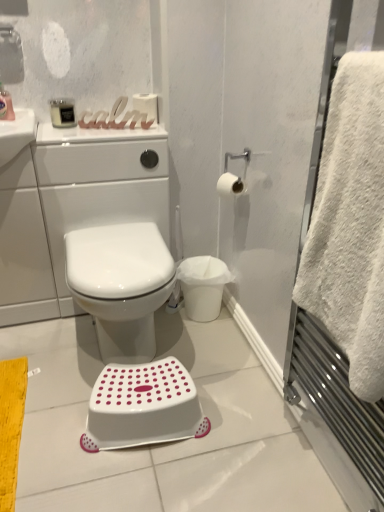
At what (x,y) coordinates should I click in order to perform the action: click on empty space that is ontop of white plastic step stool at center. Please return your answer as a coordinate pair (x, y). The width and height of the screenshot is (384, 512). Looking at the image, I should click on (143, 384).